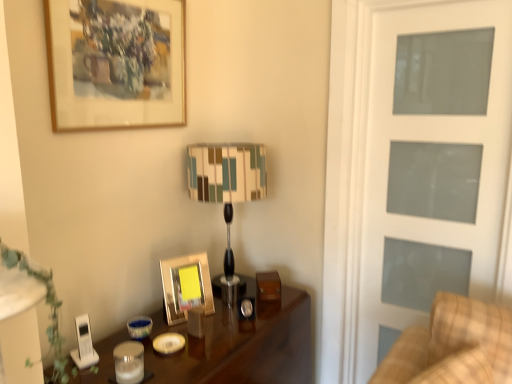
Question: Is striped fabric lampshade at center at the right side of gold metallic picture frame at center, which ranks as the first picture frame in bottom-to-top order?

Choices:
 (A) no
 (B) yes

Answer: (B)

Question: Is striped fabric lampshade at center smaller than gold metallic picture frame at center, which ranks as the first picture frame in bottom-to-top order?

Choices:
 (A) no
 (B) yes

Answer: (A)

Question: From the image's perspective, does striped fabric lampshade at center appear lower than gold metallic picture frame at center, which ranks as the first picture frame in bottom-to-top order?

Choices:
 (A) yes
 (B) no

Answer: (B)

Question: Is striped fabric lampshade at center positioned far away from gold metallic picture frame at center, which ranks as the first picture frame in bottom-to-top order?

Choices:
 (A) no
 (B) yes

Answer: (A)

Question: From a real-world perspective, does striped fabric lampshade at center stand above gold metallic picture frame at center, which ranks as the first picture frame in bottom-to-top order?

Choices:
 (A) no
 (B) yes

Answer: (B)

Question: Is white frosted glass screen door at right inside the boundaries of striped fabric lampshade at center, or outside?

Choices:
 (A) inside
 (B) outside

Answer: (B)

Question: From the image's perspective, is white frosted glass screen door at right above or below striped fabric lampshade at center?

Choices:
 (A) above
 (B) below

Answer: (B)

Question: Does point (404, 218) appear closer or farther from the camera than point (254, 190)?

Choices:
 (A) closer
 (B) farther

Answer: (B)

Question: Looking at the image, does white frosted glass screen door at right seem bigger or smaller compared to striped fabric lampshade at center?

Choices:
 (A) small
 (B) big

Answer: (A)

Question: Is gold metallic picture frame at center, which ranks as the 2th picture frame in top-to-bottom order, wider or thinner than shiny dark wood table at center?

Choices:
 (A) thin
 (B) wide

Answer: (A)

Question: Visually, is gold metallic picture frame at center, which ranks as the first picture frame in bottom-to-top order, positioned to the left or to the right of shiny dark wood table at center?

Choices:
 (A) left
 (B) right

Answer: (A)

Question: From a real-world perspective, is gold metallic picture frame at center, which ranks as the 2th picture frame in top-to-bottom order, above or below shiny dark wood table at center?

Choices:
 (A) above
 (B) below

Answer: (A)

Question: Considering the positions of gold metallic picture frame at center, which ranks as the 2th picture frame in top-to-bottom order, and shiny dark wood table at center in the image, is gold metallic picture frame at center, which ranks as the 2th picture frame in top-to-bottom order, bigger or smaller than shiny dark wood table at center?

Choices:
 (A) big
 (B) small

Answer: (B)

Question: In terms of height, does plaid fabric couch at right look taller or shorter compared to shiny dark wood table at center?

Choices:
 (A) short
 (B) tall

Answer: (A)

Question: Considering the positions of point (480, 369) and point (96, 379), is point (480, 369) closer or farther from the camera than point (96, 379)?

Choices:
 (A) farther
 (B) closer

Answer: (B)